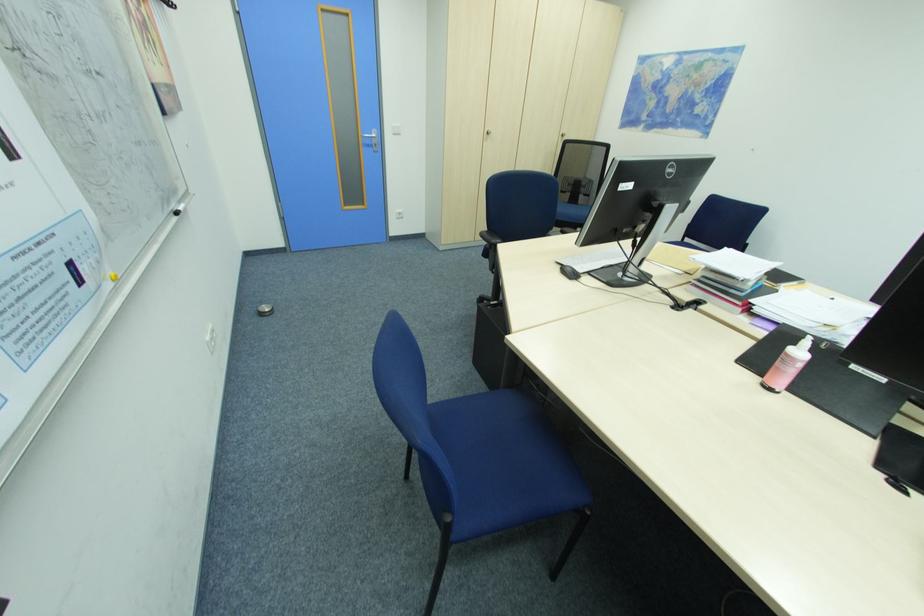
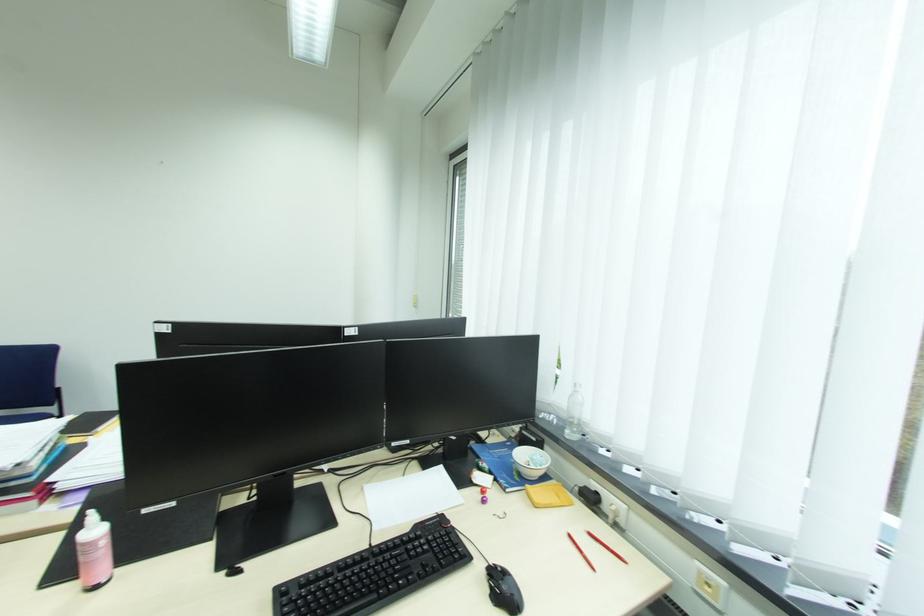
Question: The images are taken continuously from a first-person perspective. In which direction is your viewpoint rotating?

Choices:
 (A) Left
 (B) Right
 (C) Up
 (D) Down

Answer: (B)